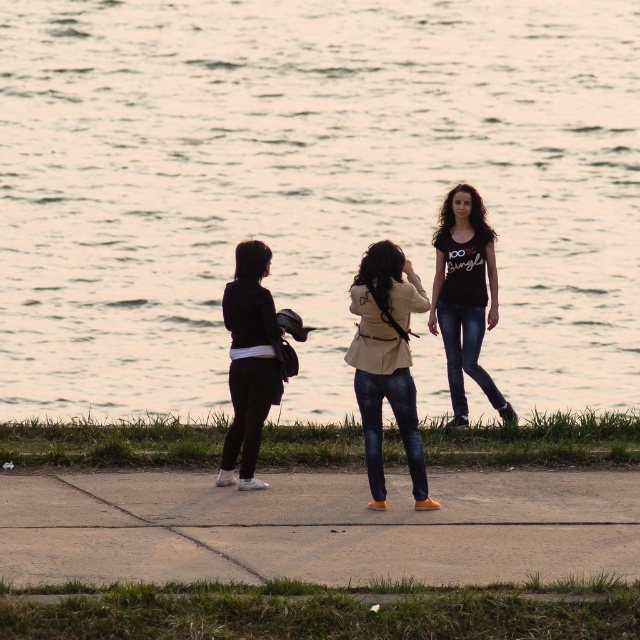
You are a photographer standing on the concrete at center. You want to take a photo of a distant tree that is 10 feet tall. If you need to be at least 20 feet away from the tree to capture it fully in your frame, will you be able to do so from your current position?

The distance between you and the camera is 35.28 feet, but the question is about the distance to the tree. Since the scene description mentions the tree isn not mentioned, we cannot determine if the 35.28 feet is the distance to the tree. Without information about the tree s location relative to the concrete, we can t confirm if it s within the required 20 feet range.

You are standing at the point labeled as point (460,305) in the image. The camera is positioned somewhere else. If you want to move towards the camera, which direction should you head? Please provide your answer in terms of the scene described.

Since the point (460,305) is 59.16 feet away from the camera, you should move towards the camera by heading in the direction opposite to where the person being photographed is facing. The person being photographed is facing the camera, so if you are at the point, you should move in the same direction the photographer is facing to approach the camera.

You are a photographer trying to frame a shot of the person wearing the black matte shirt at center and dark blue denim jeans at center. Which clothing item is positioned higher on the person?

The black matte shirt at center is above dark blue denim jeans at center, so the black matte shirt at center is positioned higher on the person.